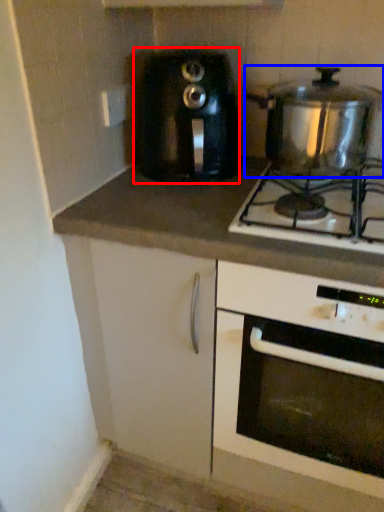
Question: Which point is further to the camera, toaster (highlighted by a red box) or kitchen appliance (highlighted by a blue box)?

Choices:
 (A) toaster
 (B) kitchen appliance

Answer: (A)